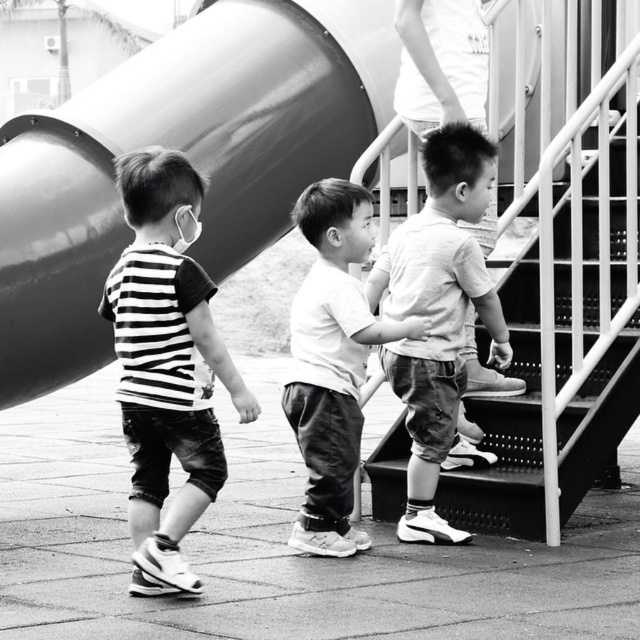
Based on the scene description, can you determine which object is taller between the smooth metal slide at upper left and the smooth white shirt at center?

The smooth metal slide at upper left is taller than the smooth white shirt at center according to the description.